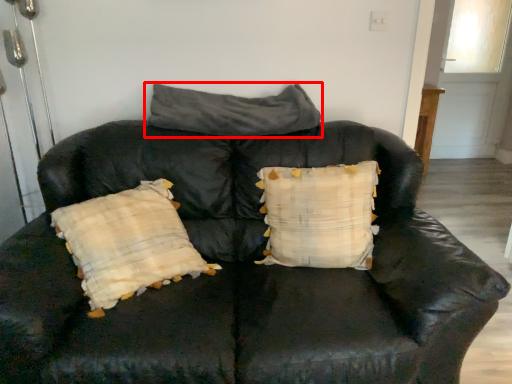
Question: From the image, what is the correct spatial relationship of pillow (annotated by the red box) in relation to pillow?

Choices:
 (A) right
 (B) left

Answer: (B)